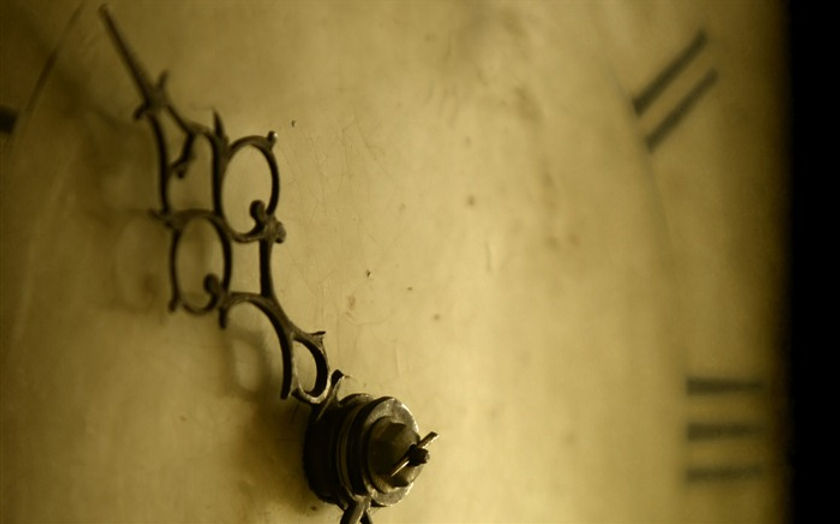
Find the location of `center of clock`. center of clock is located at coordinates (402, 456).